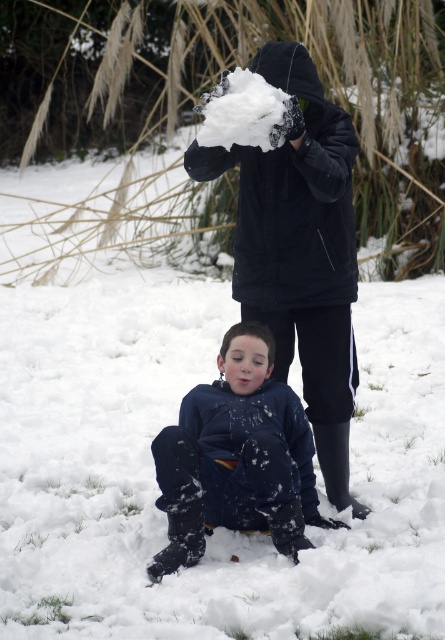
Looking at this image, you are a photographer trying to capture a candid shot of both the matte black jacket at upper center and the dark blue fleece at lower center in the same frame. Based on their positions, which subject should you focus on first to ensure both are in the frame?

You should focus on the dark blue fleece at lower center first because the matte black jacket at upper center is positioned to its right side, so adjusting the frame from the left side will include both.

You are a photographer trying to capture the scene where the child is sitting on the snow. To ensure both the child and the person with the matte black jacket at upper center are in focus, where should you position your camera relative to the child?

The matte black jacket at upper center is located at point (300, 252), so position the camera slightly above and to the right of the child to include both subjects in the frame.

Based on the scene description, which object is taller, the matte black jacket at upper center or the dark blue fleece at lower center?

The matte black jacket at upper center is taller than the dark blue fleece at lower center according to the description.